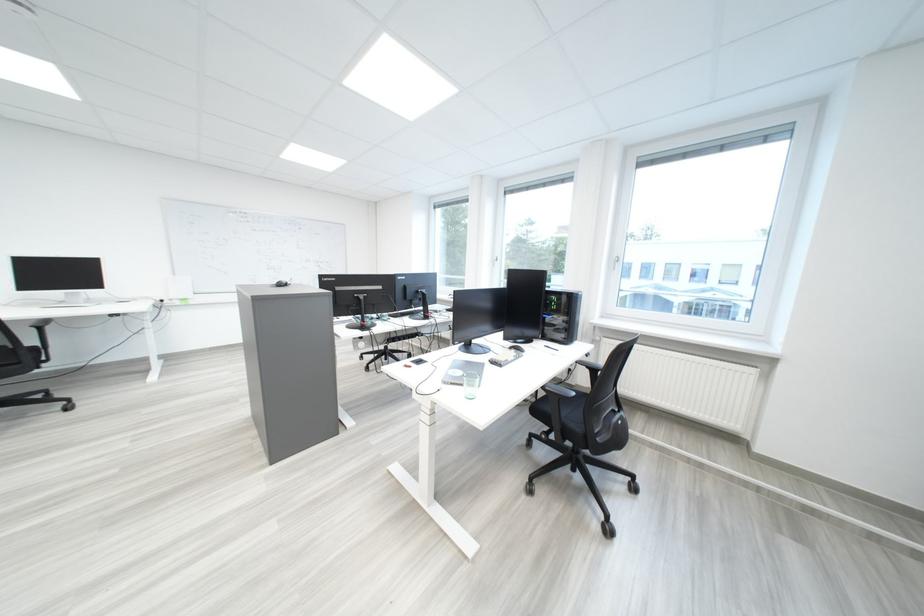
The width and height of the screenshot is (924, 616). Describe the element at coordinates (616, 264) in the screenshot. I see `the white window handle` at that location.